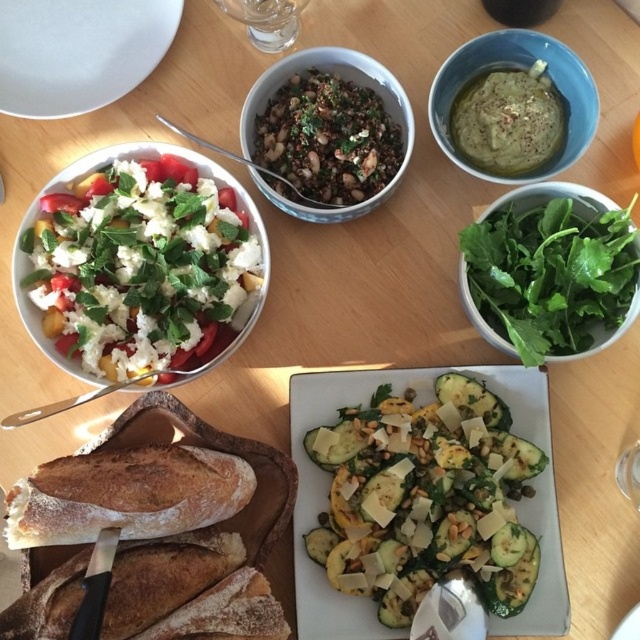
Question: Observing the image, what is the correct spatial positioning of green leafy salad at upper right in reference to grilled zucchini at center?

Choices:
 (A) below
 (B) above

Answer: (B)

Question: Is the position of fresh green salad with crumbled white cheese at upper left less distant than that of green leafy salad at upper right?

Choices:
 (A) yes
 (B) no

Answer: (B)

Question: Which is farther from the brown crusty bread at lower left?

Choices:
 (A) green matte hummus at upper right
 (B) fresh green salad with crumbled white cheese at upper left
 (C) green leafy salad at upper right
 (D) white matte plate at upper left

Answer: (A)

Question: Is fresh green salad with crumbled white cheese at upper left in front of green matte hummus at upper right?

Choices:
 (A) no
 (B) yes

Answer: (B)

Question: Which point is closer to the camera?

Choices:
 (A) (132, 538)
 (B) (109, 80)
 (C) (518, 224)

Answer: (A)

Question: Considering the real-world distances, which object is closest to the brown crusty bread at lower left?

Choices:
 (A) matte brown quinoa salad at center
 (B) white matte plate at upper left

Answer: (A)